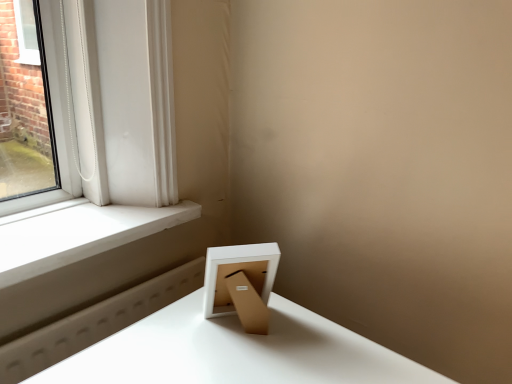
What is the approximate width of white smooth window sill at left?

The width of white smooth window sill at left is 9.32 inches.

This screenshot has width=512, height=384. I want to click on white smooth window sill at left, so click(77, 234).

What do you see at coordinates (77, 234) in the screenshot?
I see `white smooth window sill at left` at bounding box center [77, 234].

This screenshot has height=384, width=512. What do you see at coordinates (234, 271) in the screenshot? I see `white matte picture frame at lower right` at bounding box center [234, 271].

The width and height of the screenshot is (512, 384). I want to click on white matte picture frame at lower right, so click(234, 271).

Where is `white smooth window sill at left`? Image resolution: width=512 pixels, height=384 pixels. white smooth window sill at left is located at coordinates (77, 234).

Visually, is white matte picture frame at lower right positioned to the left or to the right of white smooth window sill at left?

white matte picture frame at lower right is to the right of white smooth window sill at left.

Considering their positions, is white matte picture frame at lower right located in front of or behind white smooth window sill at left?

white matte picture frame at lower right is in front of white smooth window sill at left.

Is point (207, 304) farther from viewer compared to point (122, 210)?

No, (207, 304) is closer to viewer.

From the image's perspective, is white matte picture frame at lower right above or below white smooth window sill at left?

From the image's perspective, white matte picture frame at lower right appears below white smooth window sill at left.

From the picture: From a real-world perspective, between white matte picture frame at lower right and white smooth window sill at left, who is vertically lower?

In real-world perspective, white smooth window sill at left is lower.

Which of these two, white matte picture frame at lower right or white smooth window sill at left, is wider?

Wider between the two is white smooth window sill at left.

Is white matte picture frame at lower right taller or shorter than white smooth window sill at left?

In the image, white matte picture frame at lower right appears to be taller than white smooth window sill at left.

Based on their sizes in the image, would you say white matte picture frame at lower right is bigger or smaller than white smooth window sill at left?

In the image, white matte picture frame at lower right appears to be smaller than white smooth window sill at left.

Is white matte picture frame at lower right outside of white smooth window sill at left?

Absolutely, white matte picture frame at lower right is external to white smooth window sill at left.

Are white matte picture frame at lower right and white smooth window sill at left beside each other?

No.

Is white matte picture frame at lower right facing towards white smooth window sill at left?

No, white matte picture frame at lower right is not oriented towards white smooth window sill at left.

How many degrees apart are the facing directions of white matte picture frame at lower right and white smooth window sill at left?

white matte picture frame at lower right and white smooth window sill at left are facing 143 degrees away from each other.

Identify the location of window sill behind the white matte picture frame at lower right. (77, 234).

Is white smooth window sill at left to the left of white matte picture frame at lower right from the viewer's perspective?

Indeed, white smooth window sill at left is positioned on the left side of white matte picture frame at lower right.

Is white smooth window sill at left behind white matte picture frame at lower right?

Yes.

Which is farther from the camera, (x=16, y=214) or (x=264, y=280)?

The point (x=16, y=214) is more distant.

From the image's perspective, between white smooth window sill at left and white matte picture frame at lower right, which one is located above?

white smooth window sill at left is shown above in the image.

From a real-world perspective, is white smooth window sill at left over white matte picture frame at lower right?

Incorrect, from a real-world perspective, white smooth window sill at left is lower than white matte picture frame at lower right.

Considering the sizes of objects white smooth window sill at left and white matte picture frame at lower right in the image provided, who is thinner, white smooth window sill at left or white matte picture frame at lower right?

white matte picture frame at lower right is thinner.

From their relative heights in the image, would you say white smooth window sill at left is taller or shorter than white matte picture frame at lower right?

white smooth window sill at left is shorter than white matte picture frame at lower right.

Looking at the image, does white smooth window sill at left seem bigger or smaller compared to white matte picture frame at lower right?

Considering their sizes, white smooth window sill at left takes up more space than white matte picture frame at lower right.

Choose the correct answer: Is white smooth window sill at left inside white matte picture frame at lower right or outside it?

The correct answer is: outside.

Is white smooth window sill at left touching white matte picture frame at lower right?

white smooth window sill at left and white matte picture frame at lower right are not in contact.

Is white smooth window sill at left turned away from white matte picture frame at lower right?

No, white matte picture frame at lower right is not at the back of white smooth window sill at left.

How different are the orientations of white smooth window sill at left and white matte picture frame at lower right in degrees?

A: There is a 143-degree angle between the facing directions of white smooth window sill at left and white matte picture frame at lower right.

This screenshot has height=384, width=512. I want to click on window sill below the white matte picture frame at lower right (from a real-world perspective), so click(77, 234).

Where is `picture frame above the white smooth window sill at left (from a real-world perspective)`? picture frame above the white smooth window sill at left (from a real-world perspective) is located at coordinates (234, 271).

Where is `window sill behind the white matte picture frame at lower right`? window sill behind the white matte picture frame at lower right is located at coordinates (77, 234).